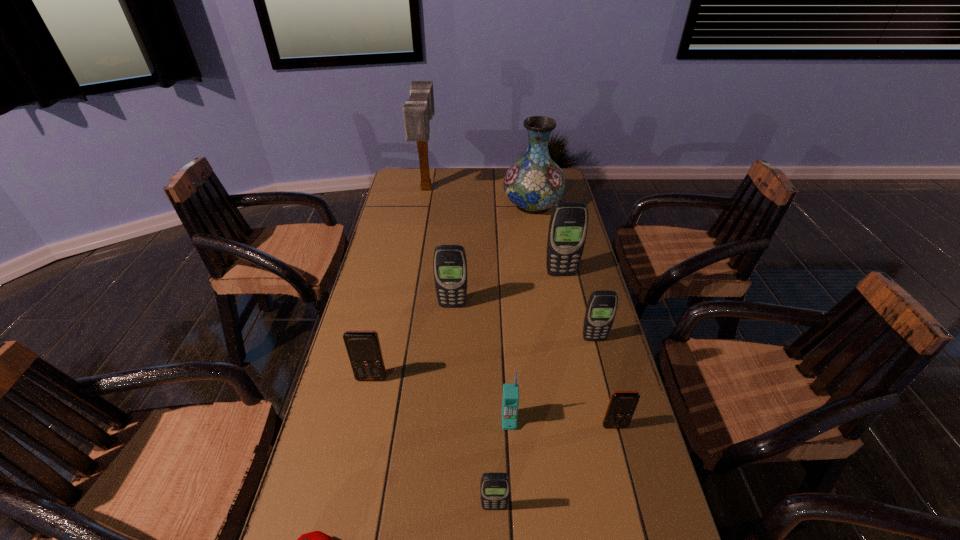
Locate an element on the screen. This screenshot has width=960, height=540. the farther orange cellular telephone is located at coordinates (364, 351).

Where is `the smaller orange cellular telephone`? Image resolution: width=960 pixels, height=540 pixels. the smaller orange cellular telephone is located at coordinates [x=622, y=404].

Where is `the nearer orange cellular telephone`? the nearer orange cellular telephone is located at coordinates 622,404.

Where is `the nearest cellular telephone`? The height and width of the screenshot is (540, 960). the nearest cellular telephone is located at coordinates (494, 487).

Locate an element on the screen. The width and height of the screenshot is (960, 540). the third gray cellular telephone from right to left is located at coordinates (494, 487).

You are a GUI agent. You are given a task and a screenshot of the screen. Output one action in this format:
    pyautogui.click(x=<x>, y=<y>)
    Task: Click on the vacant position located on the right of the wood mallet
    This screenshot has height=540, width=960.
    Given the screenshot: What is the action you would take?
    pyautogui.click(x=471, y=188)

Locate an element on the screen. Image resolution: width=960 pixels, height=540 pixels. free space located 0.110m on the left of the vase is located at coordinates (475, 205).

Locate an element on the screen. The image size is (960, 540). free spot located on the screen of the farthest cellular telephone is located at coordinates (582, 370).

Locate an element on the screen. free space located on the screen of the second tallest cellular telephone is located at coordinates coord(451,325).

This screenshot has height=540, width=960. I want to click on vacant space located 0.070m on the screen of the sixth nearest object, so click(600, 361).